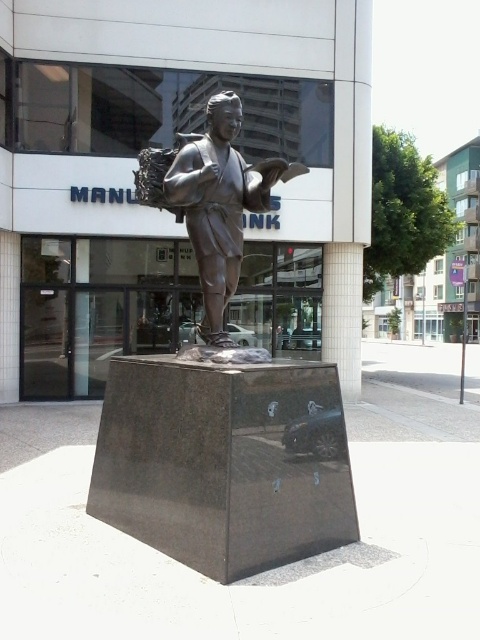
You are standing in front of a modern building and see the bronze statue at center and the smooth gray pillar at center. Which object is nearer to you?

The bronze statue at center is closer to the viewer than the smooth gray pillar at center.

Based on the photo, you are an architect reviewing the outdoor space in front of the modern building. You need to determine the relative heights of the bronze statue at center and the smooth gray pillar at center. Which one is taller?

The smooth gray pillar at center is taller than the bronze statue at center according to the description.